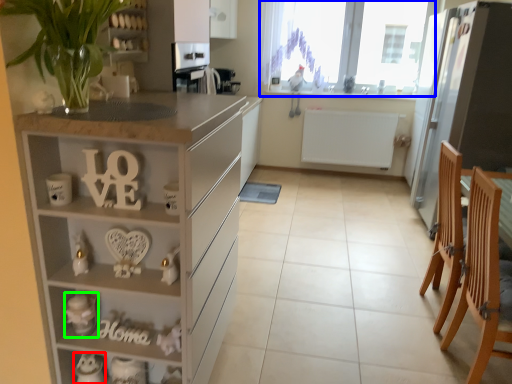
Question: Based on their relative distances, which object is farther from appliance (highlighted by a red box)? Choose from window (highlighted by a blue box) and toy (highlighted by a green box).

Choices:
 (A) window
 (B) toy

Answer: (A)